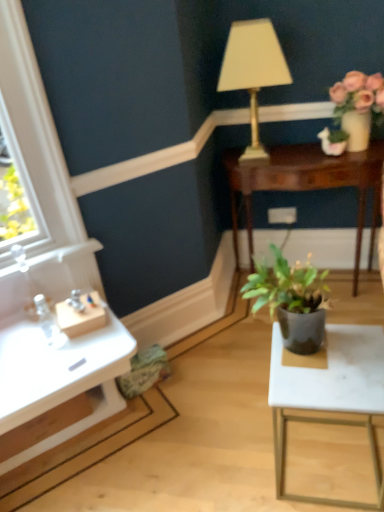
What do you see at coordinates (306, 184) in the screenshot? I see `mahogany wood table at center, positioned as the 1th table in top-to-bottom order` at bounding box center [306, 184].

Measure the distance between matte pink flowers at upper right and camera.

matte pink flowers at upper right is 5.82 feet away from camera.

This screenshot has height=512, width=384. Describe the element at coordinates (333, 141) in the screenshot. I see `green matte plant pot at upper right, which is the 1th houseplant in right-to-left order` at that location.

Where is `green matte plant pot at upper right, the second houseplant in the bottom-to-top sequence`? green matte plant pot at upper right, the second houseplant in the bottom-to-top sequence is located at coordinates (333, 141).

The width and height of the screenshot is (384, 512). What do you see at coordinates (253, 70) in the screenshot?
I see `gold metallic lamp at upper center` at bounding box center [253, 70].

What do you see at coordinates (292, 300) in the screenshot? I see `dark green matte plant pot at center, the 2th houseplant when ordered from back to front` at bounding box center [292, 300].

Describe the element at coordinates (330, 394) in the screenshot. I see `white marble table at lower right, which is the first table from bottom to top` at that location.

The width and height of the screenshot is (384, 512). I want to click on mahogany wood table at center, positioned as the 1th table in top-to-bottom order, so click(306, 184).

Locate an element on the screen. houseplant on the left of green matte plant pot at upper right, the second houseplant in the bottom-to-top sequence is located at coordinates (292, 300).

Is the depth of dark green matte plant pot at center, acting as the 1th houseplant starting from the left, greater than that of green matte plant pot at upper right, which is the 1th houseplant in right-to-left order?

No, the depth of dark green matte plant pot at center, acting as the 1th houseplant starting from the left, is less than that of green matte plant pot at upper right, which is the 1th houseplant in right-to-left order.

From a real-world perspective, is dark green matte plant pot at center, positioned as the first houseplant in front-to-back order, physically above green matte plant pot at upper right, which ranks as the second houseplant in left-to-right order?

Actually, dark green matte plant pot at center, positioned as the first houseplant in front-to-back order, is physically below green matte plant pot at upper right, which ranks as the second houseplant in left-to-right order, in the real world.

Does dark green matte plant pot at center, positioned as the first houseplant in front-to-back order, have a greater width compared to green matte plant pot at upper right, the second houseplant in the bottom-to-top sequence?

Yes, dark green matte plant pot at center, positioned as the first houseplant in front-to-back order, is wider than green matte plant pot at upper right, the second houseplant in the bottom-to-top sequence.

Is green matte plant pot at upper right, positioned as the 1th houseplant in top-to-bottom order, taller or shorter than gold metallic lamp at upper center?

Clearly, green matte plant pot at upper right, positioned as the 1th houseplant in top-to-bottom order, is shorter compared to gold metallic lamp at upper center.

In the scene shown: Is the position of green matte plant pot at upper right, which appears as the 1th houseplant when viewed from the back, more distant than that of gold metallic lamp at upper center?

Yes, it is behind gold metallic lamp at upper center.

How different are the orientations of green matte plant pot at upper right, the second houseplant in the bottom-to-top sequence, and gold metallic lamp at upper center in degrees?

The facing directions of green matte plant pot at upper right, the second houseplant in the bottom-to-top sequence, and gold metallic lamp at upper center are 0.173 degrees apart.

From the image's perspective, which is below, green matte plant pot at upper right, which is the 1th houseplant in right-to-left order, or gold metallic lamp at upper center?

green matte plant pot at upper right, which is the 1th houseplant in right-to-left order, is shown below in the image.

Is green matte plant pot at upper right, positioned as the 1th houseplant in top-to-bottom order, facing towards mahogany wood table at center, the 2th table in the front-to-back sequence?

No.

Can you confirm if green matte plant pot at upper right, which appears as the 1th houseplant when viewed from the back, is taller than mahogany wood table at center, positioned as the 1th table in top-to-bottom order?

No, green matte plant pot at upper right, which appears as the 1th houseplant when viewed from the back, is not taller than mahogany wood table at center, positioned as the 1th table in top-to-bottom order.

Does green matte plant pot at upper right, the second houseplant in the bottom-to-top sequence, lie in front of mahogany wood table at center, positioned as the 1th table in top-to-bottom order?

No, the depth of green matte plant pot at upper right, the second houseplant in the bottom-to-top sequence, is greater than that of mahogany wood table at center, positioned as the 1th table in top-to-bottom order.

Are white marble table at lower right, which is the second table in top-to-bottom order, and gold metallic lamp at upper center making contact?

No.

Is white marble table at lower right, which is the second table in top-to-bottom order, shorter than gold metallic lamp at upper center?

Indeed, white marble table at lower right, which is the second table in top-to-bottom order, has a lesser height compared to gold metallic lamp at upper center.

Image resolution: width=384 pixels, height=512 pixels. In order to click on lamp behind the white marble table at lower right, which ranks as the first table in front-to-back order in this screenshot , I will do click(x=253, y=70).

From the image's perspective, would you say white marble table at lower right, positioned as the second table in back-to-front order, is positioned over gold metallic lamp at upper center?

Actually, white marble table at lower right, positioned as the second table in back-to-front order, appears below gold metallic lamp at upper center in the image.

Is green fabric swivel chair at lower center shorter than matte pink flowers at upper right?

Yes.

Is green fabric swivel chair at lower center outside of matte pink flowers at upper right?

green fabric swivel chair at lower center is positioned outside matte pink flowers at upper right.

How much distance is there between green fabric swivel chair at lower center and matte pink flowers at upper right?

green fabric swivel chair at lower center is 1.36 meters from matte pink flowers at upper right.

Based on the photo, from a real-world perspective, is green fabric swivel chair at lower center above or below matte pink flowers at upper right?

Clearly, from a real-world perspective, green fabric swivel chair at lower center is below matte pink flowers at upper right.

Considering the sizes of matte pink flowers at upper right and mahogany wood table at center, marked as the first table in a back-to-front arrangement, in the image, is matte pink flowers at upper right bigger or smaller than mahogany wood table at center, marked as the first table in a back-to-front arrangement,?

Considering their sizes, matte pink flowers at upper right takes up less space than mahogany wood table at center, marked as the first table in a back-to-front arrangement.

How distant is matte pink flowers at upper right from mahogany wood table at center, the 2th table in the front-to-back sequence?

matte pink flowers at upper right and mahogany wood table at center, the 2th table in the front-to-back sequence, are 11.18 inches apart from each other.

Considering the relative positions of matte pink flowers at upper right and mahogany wood table at center, which ranks as the second table in bottom-to-top order, in the image provided, is matte pink flowers at upper right to the left or to the right of mahogany wood table at center, which ranks as the second table in bottom-to-top order,?

From the image, it's evident that matte pink flowers at upper right is to the right of mahogany wood table at center, which ranks as the second table in bottom-to-top order.

From a real-world perspective, does matte pink flowers at upper right sit lower than mahogany wood table at center, marked as the first table in a back-to-front arrangement?

No, from a real-world perspective, matte pink flowers at upper right is not under mahogany wood table at center, marked as the first table in a back-to-front arrangement.

Is mahogany wood table at center, positioned as the 1th table in top-to-bottom order, not close to white marble table at lower right, which is the second table in top-to-bottom order?

That's not correct — mahogany wood table at center, positioned as the 1th table in top-to-bottom order, is a little close to white marble table at lower right, which is the second table in top-to-bottom order.

Locate an element on the screen. The image size is (384, 512). table behind the white marble table at lower right, which is the second table in top-to-bottom order is located at coordinates (306, 184).

Which is more to the left, mahogany wood table at center, marked as the first table in a back-to-front arrangement, or white marble table at lower right, which is the second table in top-to-bottom order?

From the viewer's perspective, white marble table at lower right, which is the second table in top-to-bottom order, appears more on the left side.

Locate an element on the screen. Image resolution: width=384 pixels, height=512 pixels. houseplant below the green matte plant pot at upper right, positioned as the 1th houseplant in top-to-bottom order (from a real-world perspective) is located at coordinates (292, 300).

At what (x,y) coordinates should I click in order to perform the action: click on the 1st houseplant below the gold metallic lamp at upper center (from the image's perspective). Please return your answer as a coordinate pair (x, y). Image resolution: width=384 pixels, height=512 pixels. Looking at the image, I should click on (333, 141).

Consider the image. From the image, which object appears to be farther from green matte plant pot at upper right, which ranks as the second houseplant in left-to-right order, mahogany wood table at center, the 2th table in the front-to-back sequence, or dark green matte plant pot at center, which ranks as the second houseplant in top-to-bottom order?

dark green matte plant pot at center, which ranks as the second houseplant in top-to-bottom order, is positioned further to the anchor green matte plant pot at upper right, which ranks as the second houseplant in left-to-right order.

Considering their positions, is dark green matte plant pot at center, which ranks as the second houseplant in top-to-bottom order, positioned closer to matte pink flowers at upper right than green matte plant pot at upper right, which ranks as the second houseplant in left-to-right order?

green matte plant pot at upper right, which ranks as the second houseplant in left-to-right order.

Estimate the real-world distances between objects in this image. Which object is further from gold metallic lamp at upper center, white marble table at lower right, which is the second table in top-to-bottom order, or mahogany wood table at center, which ranks as the second table in bottom-to-top order?

Among the two, white marble table at lower right, which is the second table in top-to-bottom order, is located further to gold metallic lamp at upper center.

From the image, which object appears to be farther from matte pink flowers at upper right, green matte plant pot at upper right, which appears as the 1th houseplant when viewed from the back, or mahogany wood table at center, which ranks as the second table in bottom-to-top order?

mahogany wood table at center, which ranks as the second table in bottom-to-top order, is positioned further to the anchor matte pink flowers at upper right.

Considering their positions, is white marble table at lower right, which ranks as the first table in front-to-back order, positioned further to mahogany wood table at center, positioned as the 1th table in top-to-bottom order, than gold metallic lamp at upper center?

The object further to mahogany wood table at center, positioned as the 1th table in top-to-bottom order, is white marble table at lower right, which ranks as the first table in front-to-back order.

Based on their spatial positions, is gold metallic lamp at upper center or white marble table at lower right, which is the second table in top-to-bottom order, further from green fabric swivel chair at lower center?

The object further to green fabric swivel chair at lower center is gold metallic lamp at upper center.

Based on their spatial positions, is mahogany wood table at center, positioned as the 1th table in top-to-bottom order, or green matte plant pot at upper right, which appears as the 1th houseplant when viewed from the back, further from matte pink flowers at upper right?

Among the two, mahogany wood table at center, positioned as the 1th table in top-to-bottom order, is located further to matte pink flowers at upper right.

Considering their positions, is dark green matte plant pot at center, acting as the second houseplant starting from the right, positioned further to matte pink flowers at upper right than white marble table at lower right, which is the second table in top-to-bottom order?

The object further to matte pink flowers at upper right is white marble table at lower right, which is the second table in top-to-bottom order.

Identify the location of houseplant between green matte plant pot at upper right, which appears as the 1th houseplant when viewed from the back, and green fabric swivel chair at lower center in the up-down direction. (292, 300).

Image resolution: width=384 pixels, height=512 pixels. What are the coordinates of `table between dark green matte plant pot at center, acting as the second houseplant starting from the right, and green fabric swivel chair at lower center from front to back` in the screenshot? It's located at (330, 394).

Where is `floral arrangement that lies between gold metallic lamp at upper center and dark green matte plant pot at center, the first houseplant from the bottom, from top to bottom`? floral arrangement that lies between gold metallic lamp at upper center and dark green matte plant pot at center, the first houseplant from the bottom, from top to bottom is located at coordinates (358, 106).

This screenshot has height=512, width=384. I want to click on table between matte pink flowers at upper right and green fabric swivel chair at lower center in the vertical direction, so click(306, 184).